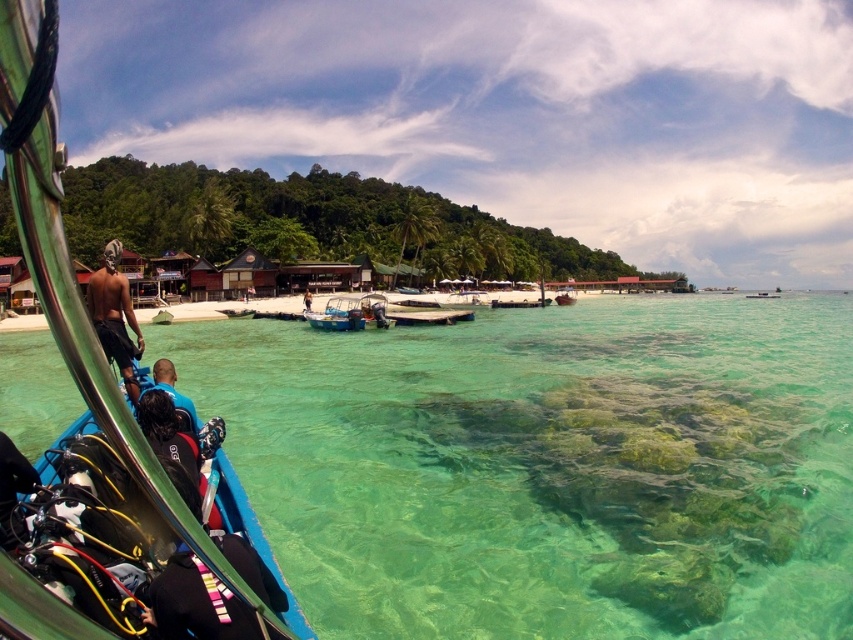
You are on a boat and want to locate the point at coordinates point (350, 312). According to the scene description, where is this point located?

The point (350, 312) is on the blue plastic boat at center.

You are on a boat and want to navigate from the boat to the dock. There are two points marked on your map, point 1 at coordinates point (326, 320) and point 2 at coordinates point (306, 292). Which point should you aim for first if you want to reach the dock in the shortest path possible?

Point (326, 320) is in front of point (306, 292), so you should aim for point (326, 320) first to reach the dock in the shortest path possible.

In the scene shown: You are on a boat and want to move from the blue plastic boat at center to the wooden boat at center. Which direction should you move to reach it?

The blue plastic boat at center is positioned on the left side of wooden boat at center, so you should move to the right to reach the wooden boat at center.